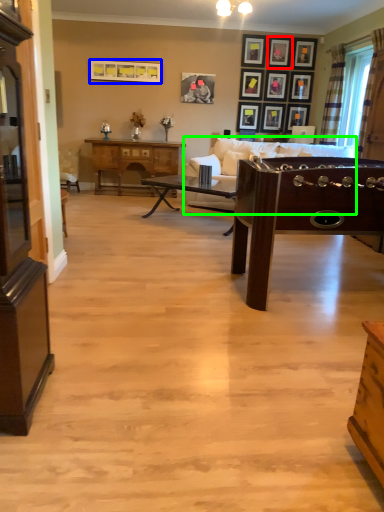
Question: Which object is positioned closest to picture frame (highlighted by a red box)? Select from picture frame (highlighted by a blue box) and studio couch (highlighted by a green box).

Choices:
 (A) picture frame
 (B) studio couch

Answer: (B)